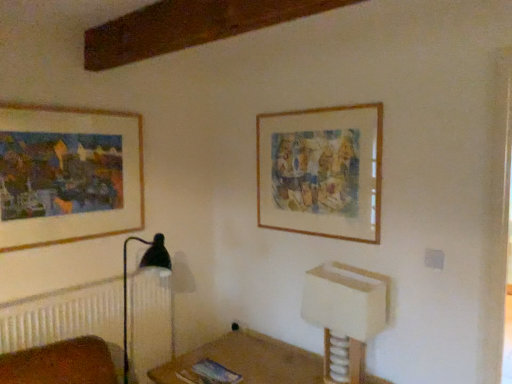
Question: Is wooden frame at upper right, arranged as the 1th picture frame when viewed from the right, in front of or behind white plastic vanity at lower right in the image?

Choices:
 (A) behind
 (B) front

Answer: (A)

Question: Does point (354, 200) appear closer or farther from the camera than point (374, 311)?

Choices:
 (A) closer
 (B) farther

Answer: (B)

Question: Based on their relative distances, which object is farther from the wooden frame at upper right, arranged as the 2th picture frame when viewed from the left?

Choices:
 (A) white plastic vanity at lower right
 (B) wooden picture frame at upper left, arranged as the first picture frame when viewed from the left

Answer: (B)

Question: Estimate the real-world distances between objects in this image. Which object is farther from the white plastic vanity at lower right?

Choices:
 (A) wooden picture frame at upper left, arranged as the first picture frame when viewed from the left
 (B) wooden frame at upper right, arranged as the 1th picture frame when viewed from the right

Answer: (A)